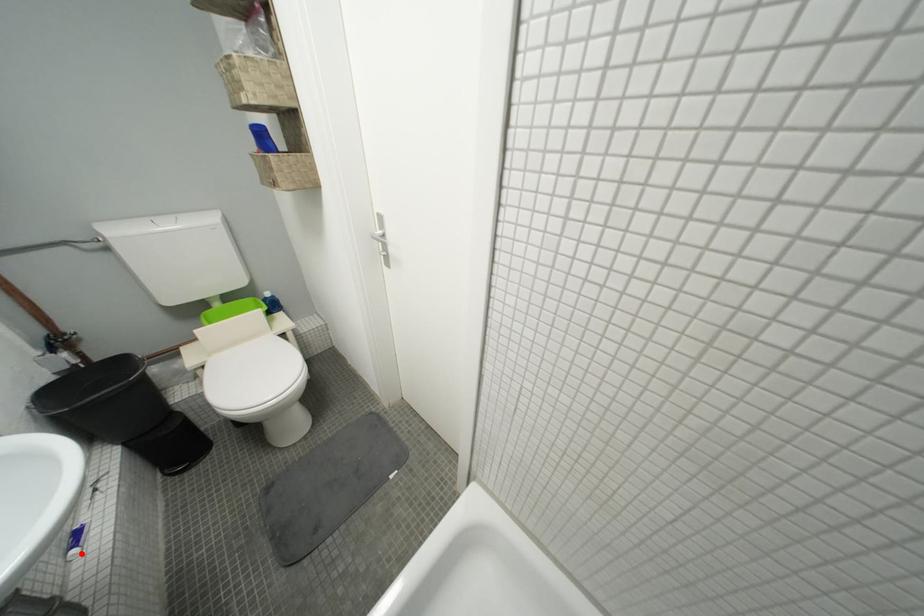
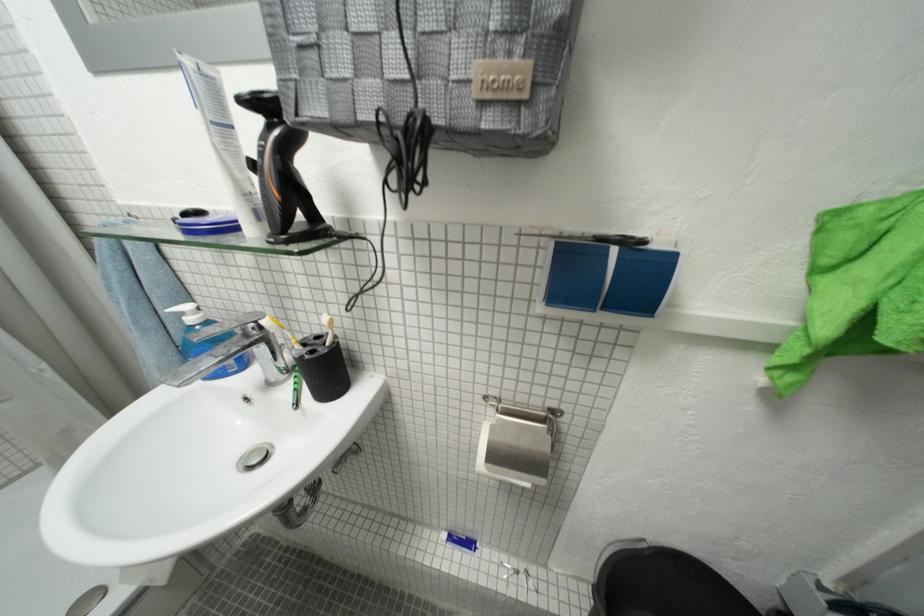
Find the pixel in the second image that matches the highlighted location in the first image.

(454, 538)